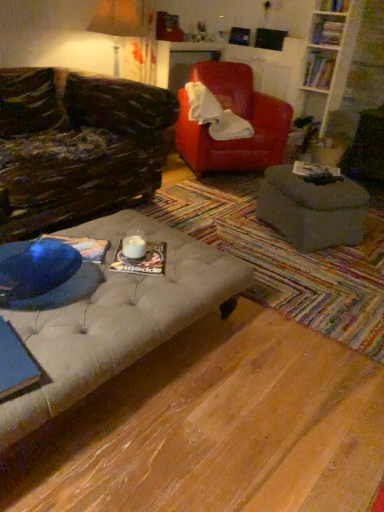
Identify the location of free spot in front of matte gray ottoman at center. Image resolution: width=384 pixels, height=512 pixels. (314, 267).